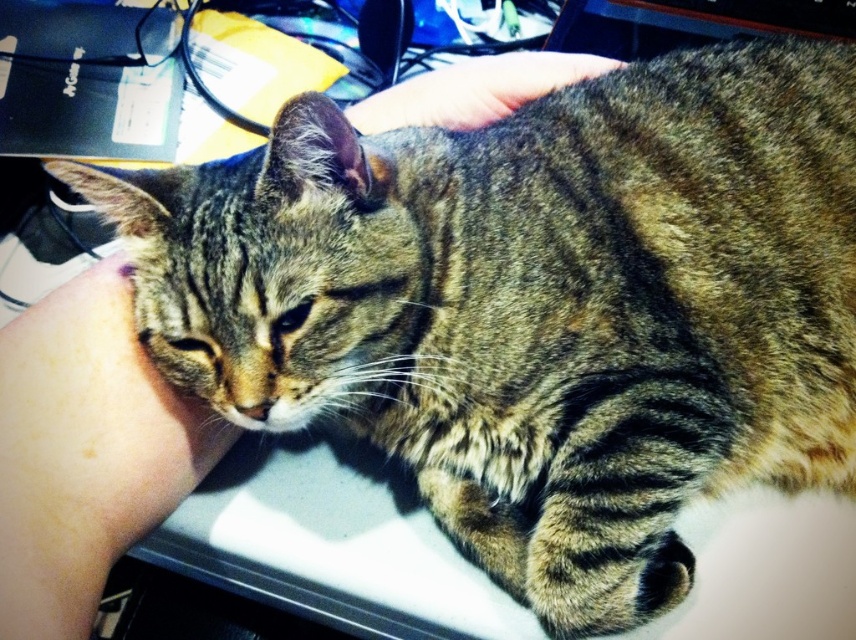
You are a veterinarian examining a cat. You notice the skinny white skin at lower left and fur at upper center. Which one is taller?

The skinny white skin at lower left is taller than fur at upper center.

You are a photographer trying to capture the perfect shot of the tabby cat on the desk. You notice a specific point marked at coordinates point (85,451). Based on the scene description, what object or feature does this point most likely represent?

The point (85,451) corresponds to the skinny white skin at lower left, which is part of the human hand resting on the cat.